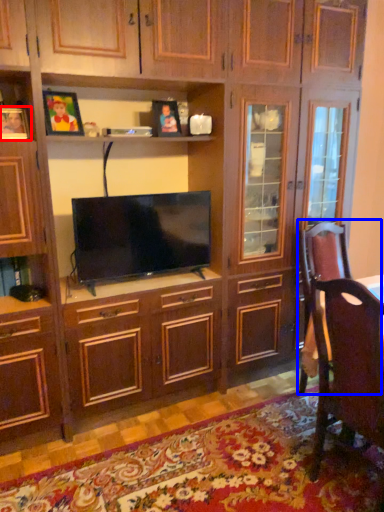
Question: Which point is further to the camera, picture frame (highlighted by a red box) or swivel chair (highlighted by a blue box)?

Choices:
 (A) picture frame
 (B) swivel chair

Answer: (B)